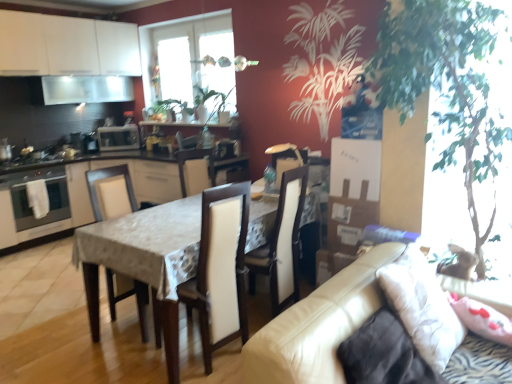
Find the location of a particular element. This screenshot has width=512, height=384. free region on the left part of wooden chair at center, acting as the 2th chair starting from the left is located at coordinates (133, 356).